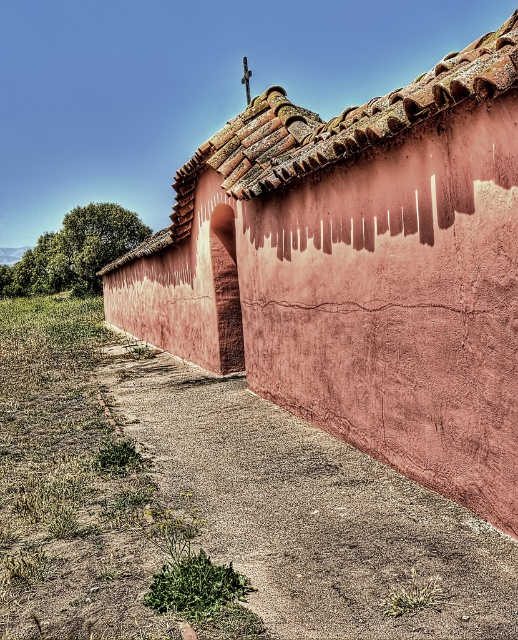
Who is more distant from viewer, [498,42] or [358,141]?

Positioned behind is point [358,141].

Does matte clay hut at center have a greater width compared to brown clay tiles at upper center?

In fact, matte clay hut at center might be narrower than brown clay tiles at upper center.

Is point (193, 227) positioned behind point (426, 86)?

Yes, point (193, 227) is farther from viewer.

Locate an element on the screen. matte clay hut at center is located at coordinates coord(357,269).